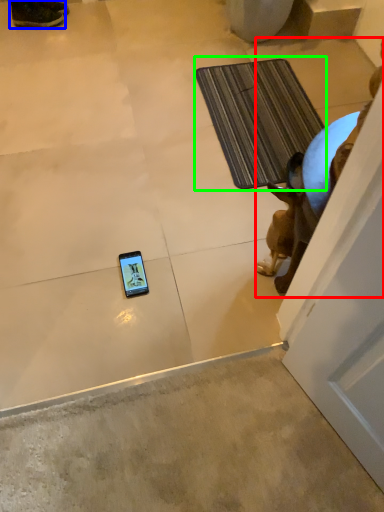
Question: Which is farther away from animal (highlighted by a red box)? footwear (highlighted by a blue box) or bath mat (highlighted by a green box)?

Choices:
 (A) footwear
 (B) bath mat

Answer: (A)